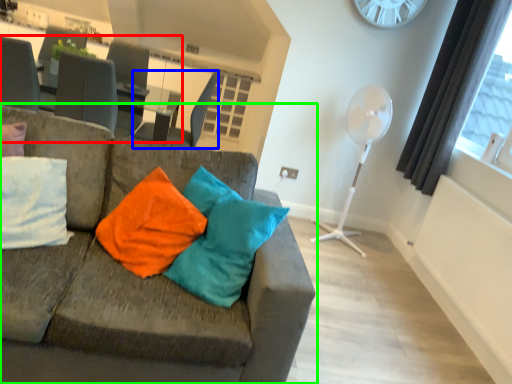
Question: Based on their relative distances, which object is nearer to table (highlighted by a red box)? Choose from swivel chair (highlighted by a blue box) and studio couch (highlighted by a green box).

Choices:
 (A) swivel chair
 (B) studio couch

Answer: (A)